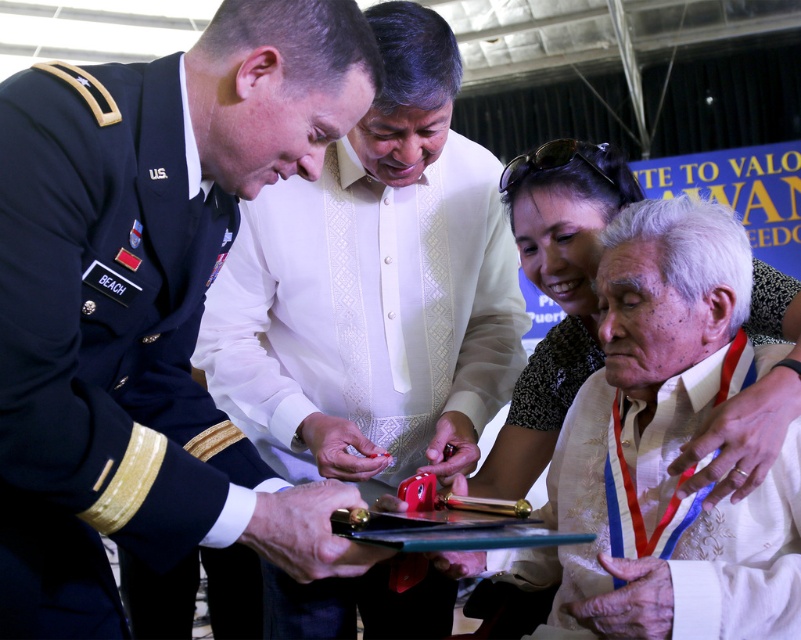
Question: Which object is the farthest from the navy blue fabric uniform at center?

Choices:
 (A) white textured shirt at center
 (B) white lace blouse at lower right

Answer: (B)

Question: Which point is closer to the camera taking this photo?

Choices:
 (A) (795, 392)
 (B) (300, 358)
 (C) (0, 522)

Answer: (C)

Question: Is navy blue fabric uniform at center further to the viewer compared to white lace blouse at lower right?

Choices:
 (A) yes
 (B) no

Answer: (B)

Question: Does white textured shirt at center come behind white lace blouse at lower right?

Choices:
 (A) no
 (B) yes

Answer: (A)

Question: Can you confirm if white textured shirt at center is bigger than white lace blouse at lower right?

Choices:
 (A) no
 (B) yes

Answer: (B)

Question: Which of the following is the farthest from the observer?

Choices:
 (A) white lace blouse at lower right
 (B) navy blue fabric uniform at center
 (C) white textured shirt at center

Answer: (A)